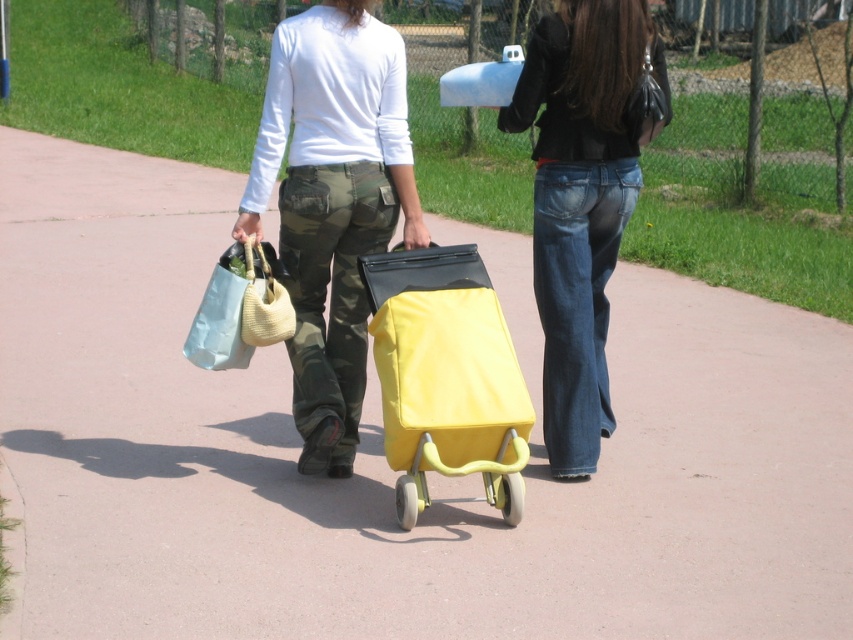
Question: Is camo pants at center positioned behind yellow matte shopping cart at center?

Choices:
 (A) no
 (B) yes

Answer: (B)

Question: Which object is the closest to the denim jeans at center?

Choices:
 (A) matte fabric bag at center
 (B) camo pants at center
 (C) yellow matte shopping cart at center

Answer: (C)

Question: Can you confirm if camo pants at center is thinner than denim jeans at center?

Choices:
 (A) no
 (B) yes

Answer: (A)

Question: Is camo pants at center positioned at the back of denim jeans at center?

Choices:
 (A) no
 (B) yes

Answer: (A)

Question: Based on their relative distances, which object is nearer to the camo pants at center?

Choices:
 (A) yellow matte shopping cart at center
 (B) denim jeans at center
 (C) matte fabric bag at center

Answer: (C)

Question: Which of the following is the closest to the observer?

Choices:
 (A) (579, 275)
 (B) (329, 170)

Answer: (B)